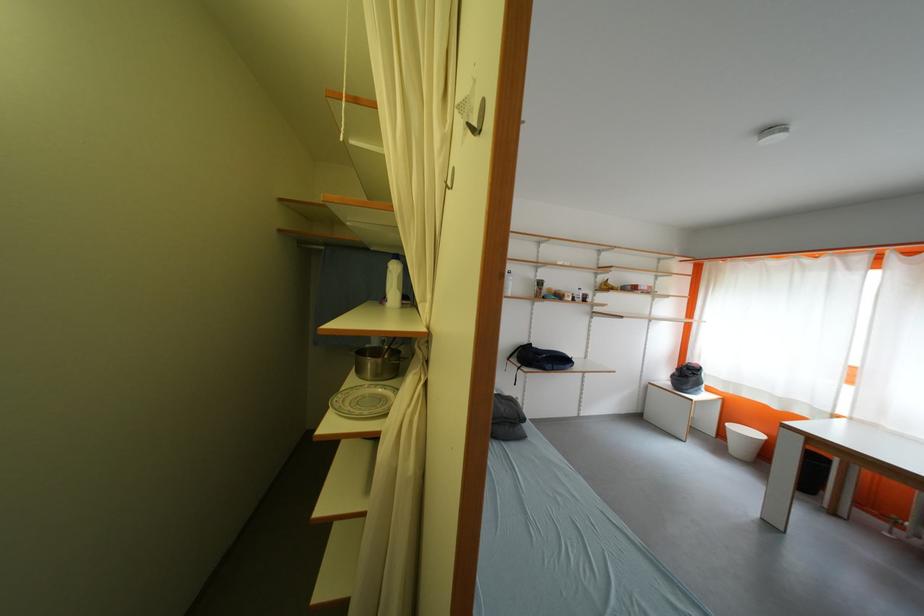
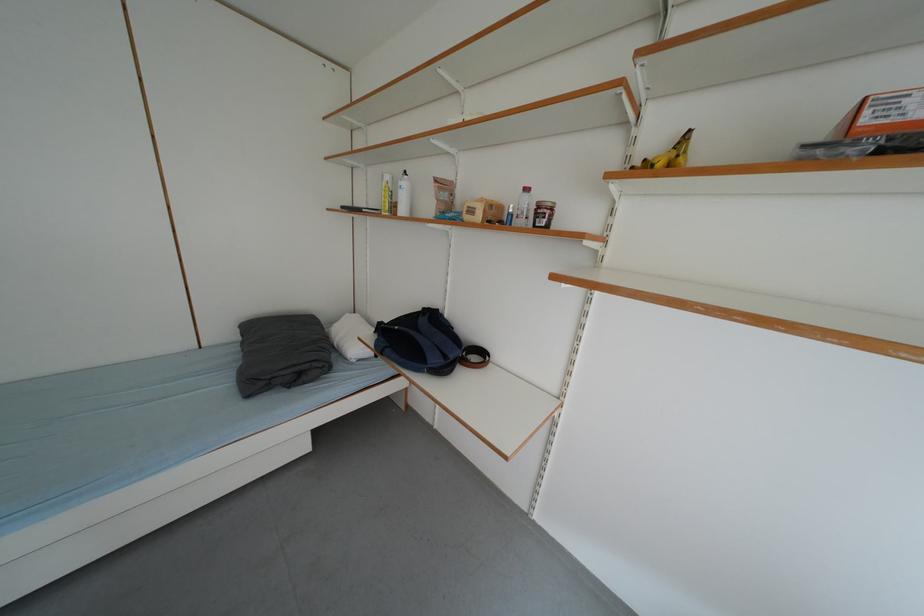
In the second image, find the point that corresponds to point 579,302 in the first image.

(487, 220)